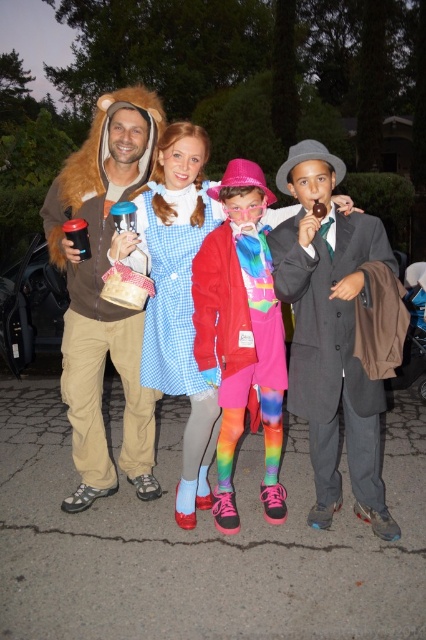
Question: In this image, where is matte blue dress at center located relative to matte gray suit at center?

Choices:
 (A) left
 (B) right

Answer: (A)

Question: Does matte gray suit at center have a lesser width compared to rainbow tights at center?

Choices:
 (A) no
 (B) yes

Answer: (A)

Question: Is fuzzy brown coat at left to the left of rainbow tights at center from the viewer's perspective?

Choices:
 (A) yes
 (B) no

Answer: (A)

Question: Which point appears closest to the camera in this image?

Choices:
 (A) (51, 259)
 (B) (219, 476)

Answer: (B)

Question: Which point is farther from the camera taking this photo?

Choices:
 (A) (138, 324)
 (B) (89, 387)
 (C) (322, 186)

Answer: (A)

Question: Based on their relative distances, which object is farther from the fuzzy brown coat at left?

Choices:
 (A) matte gray suit at center
 (B) matte blue dress at center

Answer: (A)